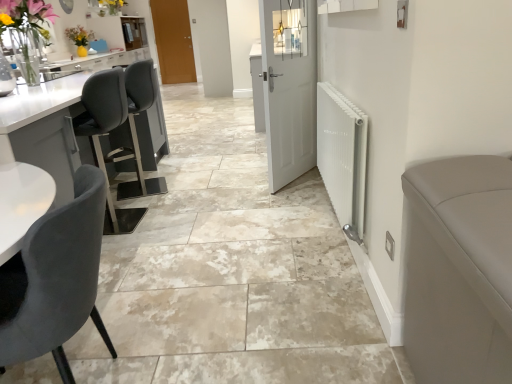
Question: Can you confirm if velvet grey chair at lower left is smaller than white glossy sink at upper left?

Choices:
 (A) yes
 (B) no

Answer: (B)

Question: Can you confirm if velvet grey chair at lower left is positioned to the left of white glossy sink at upper left?

Choices:
 (A) yes
 (B) no

Answer: (B)

Question: Can you confirm if velvet grey chair at lower left is bigger than white glossy sink at upper left?

Choices:
 (A) yes
 (B) no

Answer: (A)

Question: From the image's perspective, is velvet grey chair at lower left under white glossy sink at upper left?

Choices:
 (A) yes
 (B) no

Answer: (A)

Question: Is velvet grey chair at lower left closer to the viewer compared to white glossy sink at upper left?

Choices:
 (A) no
 (B) yes

Answer: (B)

Question: Is velvet grey chair at lower left not within white glossy sink at upper left?

Choices:
 (A) yes
 (B) no

Answer: (A)

Question: Considering the relative sizes of velvet grey chair at lower left and brown wooden door at upper center, marked as the first door in a back-to-front arrangement, in the image provided, is velvet grey chair at lower left thinner than brown wooden door at upper center, marked as the first door in a back-to-front arrangement,?

Choices:
 (A) no
 (B) yes

Answer: (A)

Question: Does velvet grey chair at lower left have a smaller size compared to brown wooden door at upper center, arranged as the 2th door when viewed from the front?

Choices:
 (A) yes
 (B) no

Answer: (B)

Question: Considering the relative positions of velvet grey chair at lower left and brown wooden door at upper center, which appears as the 2th door when ordered from the bottom, in the image provided, is velvet grey chair at lower left to the left of brown wooden door at upper center, which appears as the 2th door when ordered from the bottom, from the viewer's perspective?

Choices:
 (A) yes
 (B) no

Answer: (B)

Question: Is velvet grey chair at lower left positioned in front of brown wooden door at upper center, marked as the first door in a back-to-front arrangement?

Choices:
 (A) no
 (B) yes

Answer: (B)

Question: Is brown wooden door at upper center, arranged as the 1th door when viewed from the left, inside velvet grey chair at lower left?

Choices:
 (A) yes
 (B) no

Answer: (B)

Question: Is velvet grey chair at lower left shorter than brown wooden door at upper center, which is the 1th door from top to bottom?

Choices:
 (A) yes
 (B) no

Answer: (A)

Question: Is white matte door at center, which is counted as the second door, starting from the top, oriented away from white glossy sink at upper left?

Choices:
 (A) yes
 (B) no

Answer: (B)